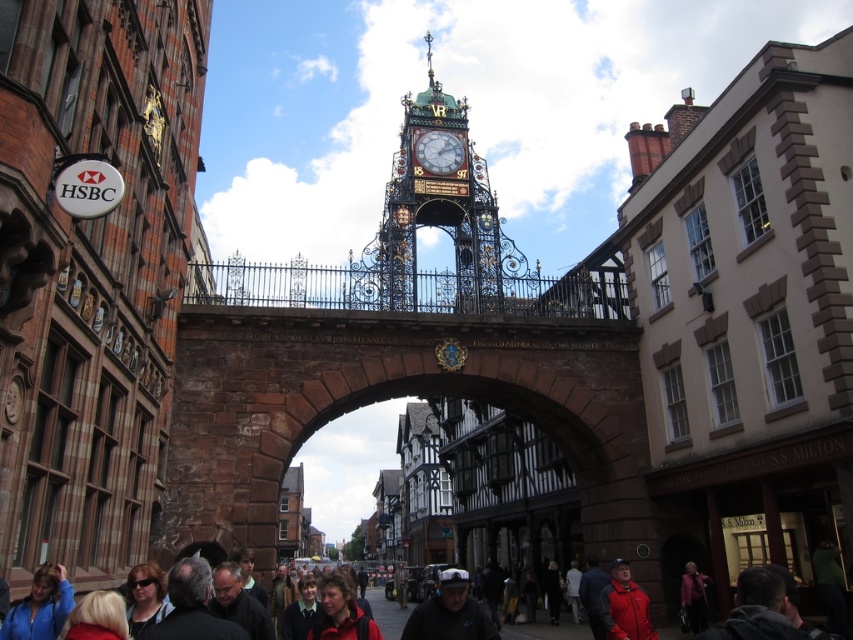
How far apart are gold-plated ornate clock tower at center and matte pink coat at lower center?

A distance of 55.01 meters exists between gold-plated ornate clock tower at center and matte pink coat at lower center.

What do you see at coordinates (438, 205) in the screenshot? The image size is (853, 640). I see `gold-plated ornate clock tower at center` at bounding box center [438, 205].

Describe the element at coordinates (438, 205) in the screenshot. The height and width of the screenshot is (640, 853). I see `gold-plated ornate clock tower at center` at that location.

At what (x,y) coordinates should I click in order to perform the action: click on gold-plated ornate clock tower at center. Please return your answer as a coordinate pair (x, y). The height and width of the screenshot is (640, 853). Looking at the image, I should click on (438, 205).

Measure the distance between point (495, 394) and camera.

They are 80.69 meters apart.

Does brown stone bridge at center have a lesser width compared to polished brass clock at center?

No.

Is point (181, 438) positioned before point (415, 150)?

Yes, point (181, 438) is in front of point (415, 150).

Locate an element on the screen. brown stone bridge at center is located at coordinates [x=387, y=397].

Between blue fleece jacket at lower left and red jacket at lower center, which one appears on the left side from the viewer's perspective?

Positioned to the left is blue fleece jacket at lower left.

Does blue fleece jacket at lower left have a greater height compared to red jacket at lower center?

No, blue fleece jacket at lower left is not taller than red jacket at lower center.

Is point (15, 612) positioned before point (347, 595)?

Yes, it is in front of point (347, 595).

In order to click on blue fleece jacket at lower left in this screenshot , I will do coord(39,605).